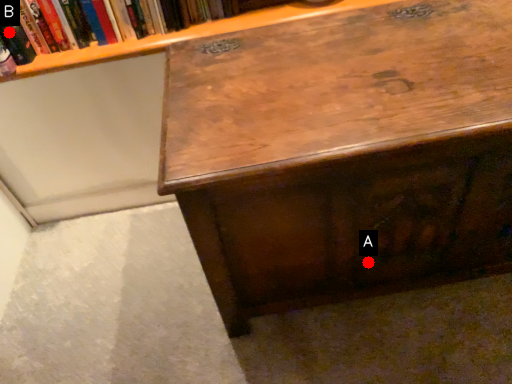
Question: Two points are circled on the image, labeled by A and B beside each circle. Which of the following is the farthest from the observer?

Choices:
 (A) A is further
 (B) B is further

Answer: (B)